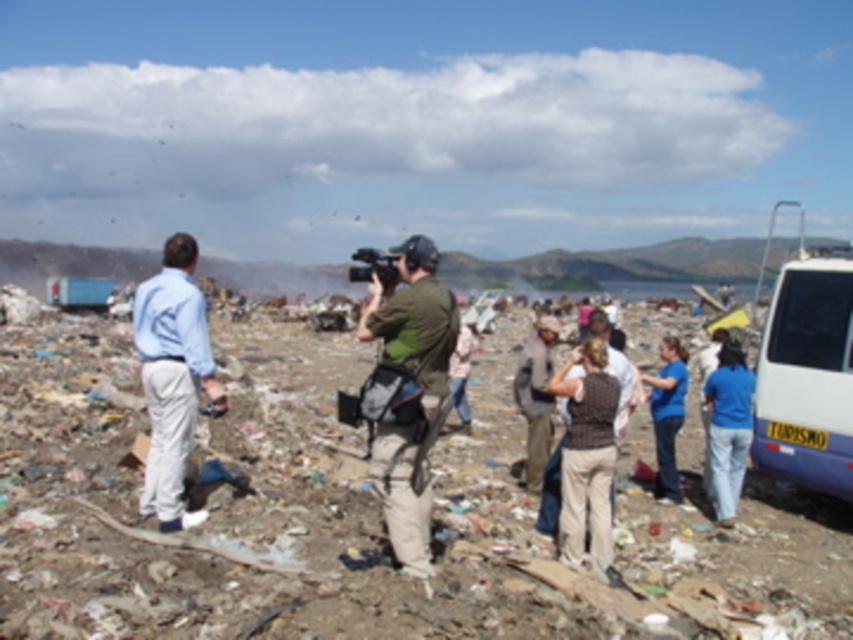
Question: Which object is positioned closest to the brown knitted vest at center?

Choices:
 (A) light blue shirt at left
 (B) white plastic van at right
 (C) green fabric camera at center

Answer: (C)

Question: Which is farther from the green fabric camera at center?

Choices:
 (A) light blue shirt at left
 (B) brown knitted vest at center
 (C) white plastic van at right

Answer: (C)

Question: Does green fabric camera at center appear under blue cotton shirt at center?

Choices:
 (A) no
 (B) yes

Answer: (A)

Question: Is light blue shirt at left to the right of blue jeans at lower right from the viewer's perspective?

Choices:
 (A) no
 (B) yes

Answer: (A)

Question: Does green fabric camera at center lie in front of light blue shirt at left?

Choices:
 (A) no
 (B) yes

Answer: (B)

Question: Among these points, which one is nearest to the camera?

Choices:
 (A) (660, 356)
 (B) (728, 481)

Answer: (B)